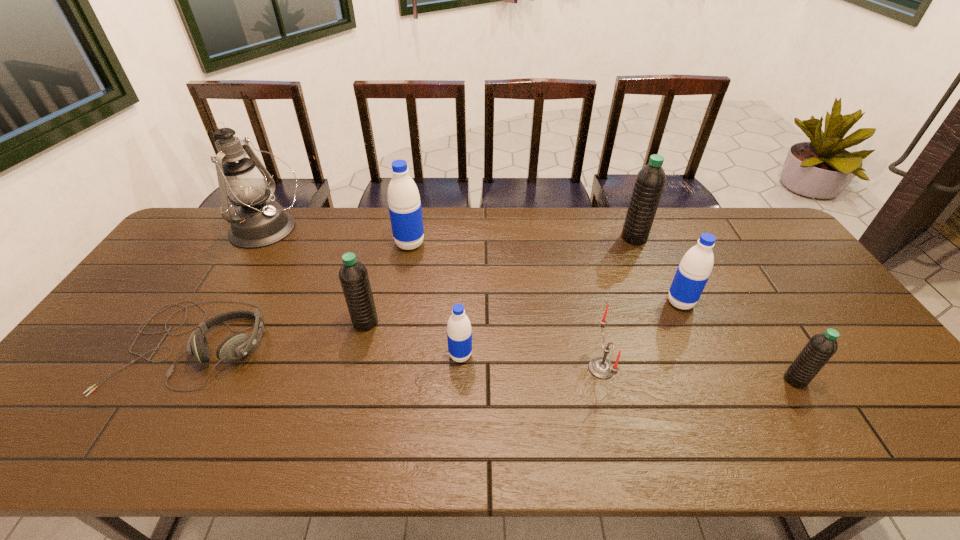
Image resolution: width=960 pixels, height=540 pixels. I want to click on the tallest object, so click(x=258, y=222).

Locate an element on the screen. This screenshot has width=960, height=540. the leftmost blue water bottle is located at coordinates (404, 204).

Locate an element on the screen. the farthest blue water bottle is located at coordinates (404, 204).

This screenshot has height=540, width=960. Find the location of `the biggest black water bottle`. the biggest black water bottle is located at coordinates (650, 181).

You are a GUI agent. You are given a task and a screenshot of the screen. Output one action in this format:
    pyautogui.click(x=<x>, y=<y>)
    Task: Click on the farthest black water bottle
    
    Given the screenshot: What is the action you would take?
    pyautogui.click(x=650, y=181)

Identify the location of the second biggest black water bottle. pos(353,275).

This screenshot has width=960, height=540. I want to click on the leftmost black water bottle, so click(x=353, y=275).

In order to click on the second farthest blue water bottle in this screenshot , I will do `click(693, 272)`.

Locate an element on the screen. the rightmost blue water bottle is located at coordinates (693, 272).

At what (x,y) coordinates should I click in order to perform the action: click on the nearest black water bottle. Please return your answer as a coordinate pair (x, y). The width and height of the screenshot is (960, 540). Looking at the image, I should click on (821, 347).